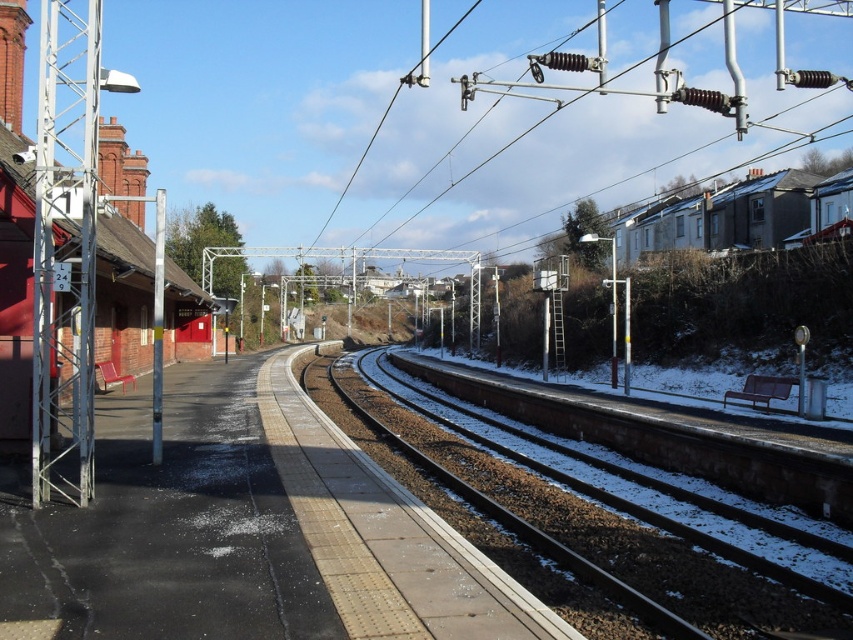
Describe the element at coordinates (631, 536) in the screenshot. This screenshot has height=640, width=853. I see `brown gravel track at center` at that location.

Is brown gravel track at center smaller than white matte houses at upper right?

Indeed, brown gravel track at center has a smaller size compared to white matte houses at upper right.

I want to click on brown gravel track at center, so [x=631, y=536].